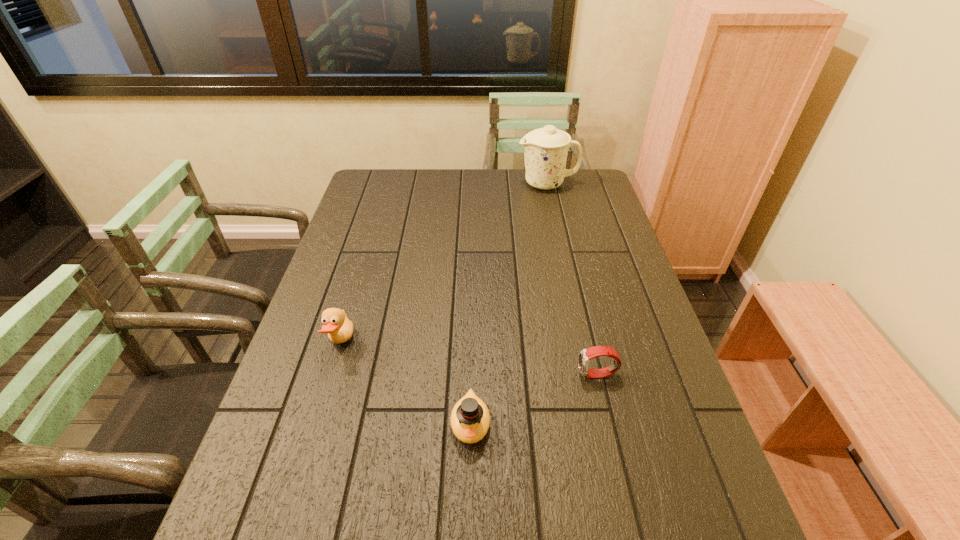
Locate an element on the screen. vacant area situated 0.230m on the beak of the third shortest object is located at coordinates (444, 343).

Identify the location of free point located on the front-facing side of the nearest object. Image resolution: width=960 pixels, height=540 pixels. (468, 538).

Identify the location of blank area located 0.140m on the face of the shortest object. The height and width of the screenshot is (540, 960). (518, 375).

This screenshot has width=960, height=540. What are the coordinates of `vacant space positioned 0.320m on the face of the shortest object` in the screenshot? It's located at (443, 375).

Locate an element on the screen. This screenshot has width=960, height=540. vacant area situated 0.240m on the face of the shortest object is located at coordinates (476, 375).

Locate an element on the screen. The width and height of the screenshot is (960, 540). object present at the far edge is located at coordinates (545, 149).

The height and width of the screenshot is (540, 960). I want to click on object present at the left edge, so click(x=339, y=328).

Where is `chinaware that is at the right edge`? The width and height of the screenshot is (960, 540). chinaware that is at the right edge is located at coordinates (545, 149).

Where is `watch situated at the right edge`? The height and width of the screenshot is (540, 960). watch situated at the right edge is located at coordinates (585, 355).

Find the location of a particular element. This screenshot has width=960, height=540. object present at the far right corner is located at coordinates (545, 149).